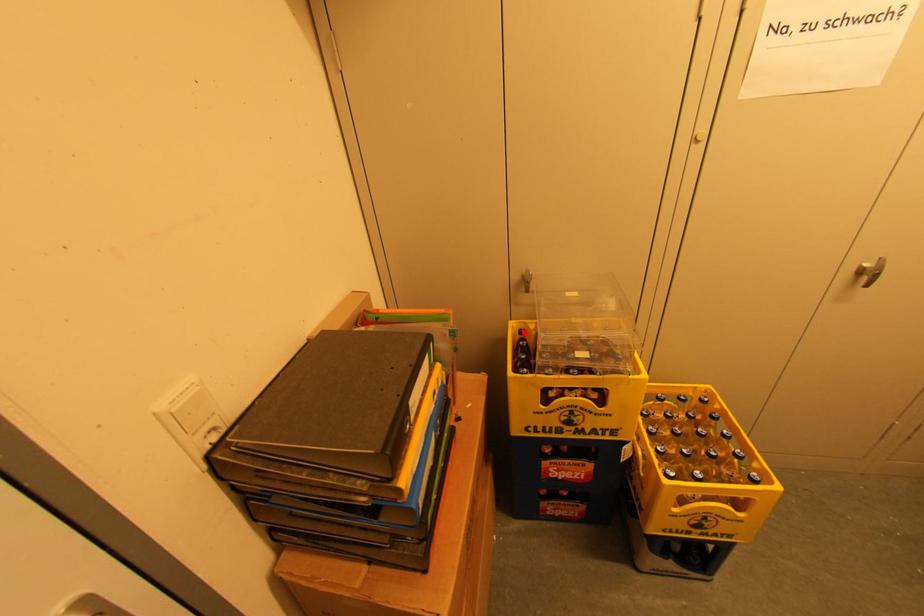
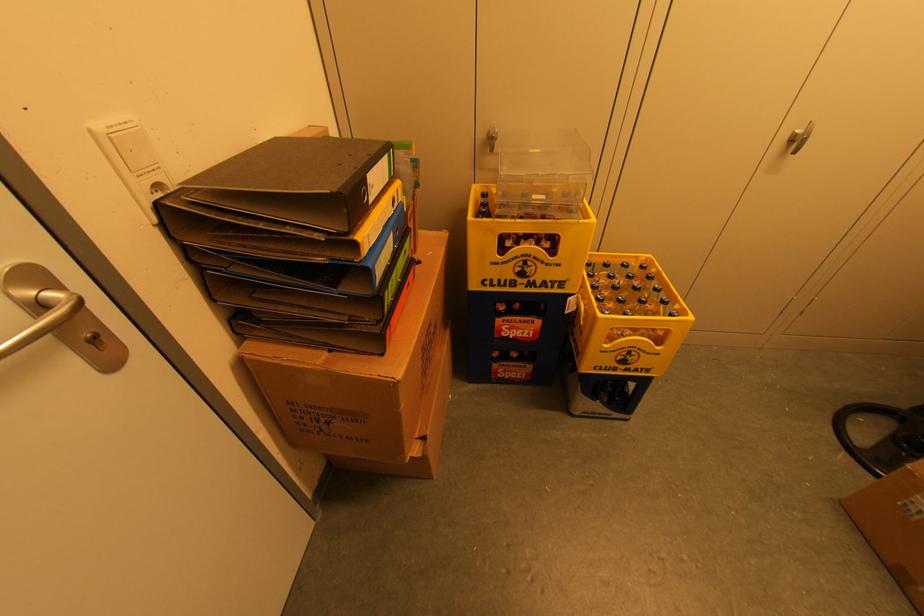
Find the pixel in the second image that matches the highlighted location in the first image.

(487, 196)